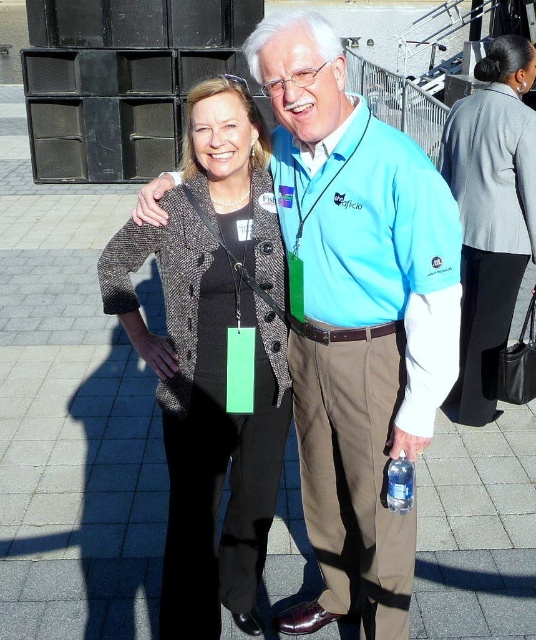
Between gray wool blazer at upper right and clear plastic bottle at lower right, which one is positioned higher?

gray wool blazer at upper right is above.

Between gray wool blazer at upper right and clear plastic bottle at lower right, which one has more height?

With more height is gray wool blazer at upper right.

Which is behind, point (523, 116) or point (405, 456)?

The point (523, 116) is more distant.

You are a GUI agent. You are given a task and a screenshot of the screen. Output one action in this format:
    pyautogui.click(x=<x>, y=<y>)
    Task: Click on the gray wool blazer at upper right
    The height and width of the screenshot is (640, 536).
    Given the screenshot: What is the action you would take?
    pyautogui.click(x=490, y=212)

Who is taller, textured tweed blazer at center or gray wool blazer at upper right?

With more height is gray wool blazer at upper right.

The height and width of the screenshot is (640, 536). What do you see at coordinates (212, 358) in the screenshot?
I see `textured tweed blazer at center` at bounding box center [212, 358].

Locate an element on the screen. The height and width of the screenshot is (640, 536). textured tweed blazer at center is located at coordinates (212, 358).

Who is more distant from viewer, [371,314] or [390,496]?

The point [390,496] is behind.

Can you confirm if blue fabric shirt at center is positioned to the left of clear plastic bottle at lower right?

Yes, blue fabric shirt at center is to the left of clear plastic bottle at lower right.

Which is behind, point (390, 280) or point (403, 502)?

Positioned behind is point (403, 502).

I want to click on blue fabric shirt at center, so click(x=356, y=316).